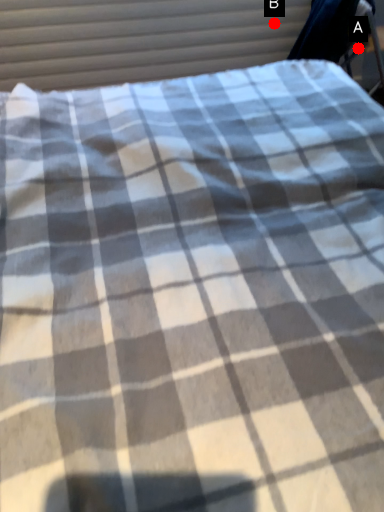
Question: Two points are circled on the image, labeled by A and B beside each circle. Which point is closer to the camera?

Choices:
 (A) A is closer
 (B) B is closer

Answer: (B)